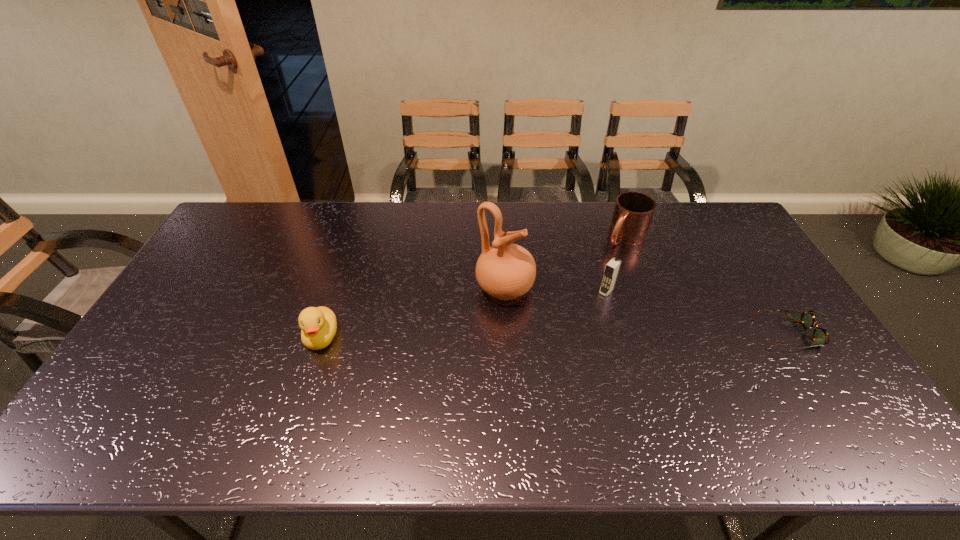
Identify the location of vacant space on the desktop that is between the duckling and the rightmost object and is positioned on the spout of the tallest object. The width and height of the screenshot is (960, 540). (600, 335).

The width and height of the screenshot is (960, 540). What are the coordinates of `vacant spot on the desktop that is between the leftmost object and the shortest object and is positioned on the side of the farthest object with the handle` in the screenshot? It's located at pos(529,335).

I want to click on free space on the desktop that is between the leftmost object and the rightmost object and is positioned on the front-facing side of the cellular telephone, so click(565, 335).